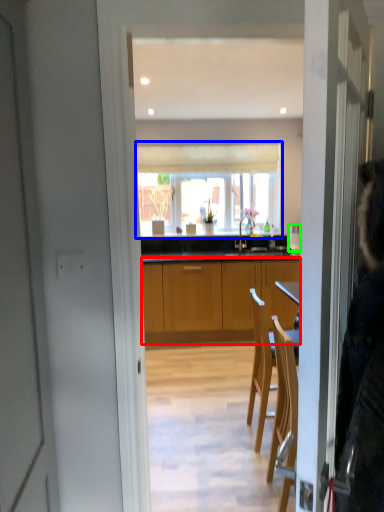
Question: Which is nearer to the cabinetry (highlighted by a red box)? window (highlighted by a blue box) or kitchen appliance (highlighted by a green box).

Choices:
 (A) window
 (B) kitchen appliance

Answer: (A)